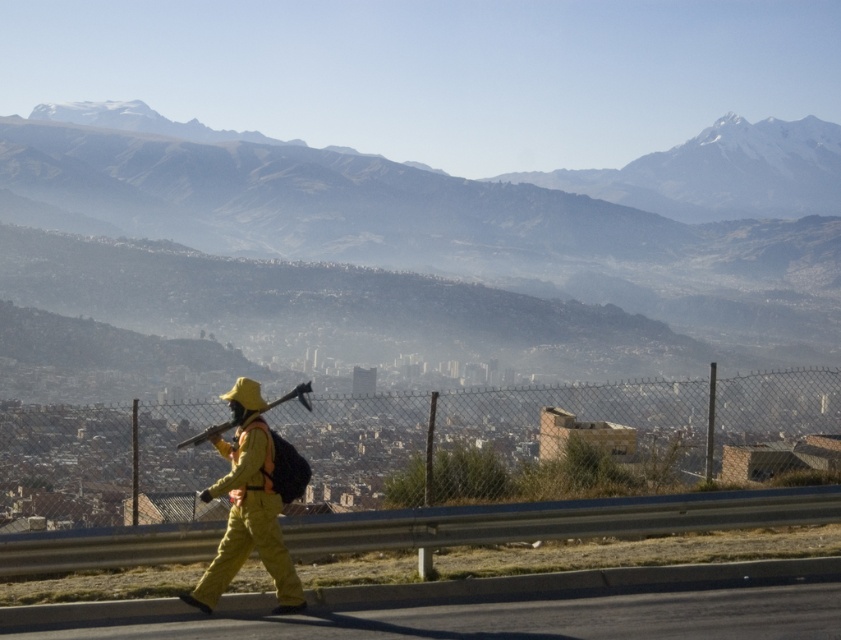
You are a delivery driver who needs to turn left onto the black asphalt highway at lower center. Given that your truck has a turning radius of 12 meters, can you make the turn from your current position at point [532,618]?

The point [532,618] corresponds to the black asphalt highway at lower center. Since the truck requires a turning radius of 12 meters, you would need to ensure there is sufficient space to maneuver. However, the provided information does not include details about the actual dimensions or layout of the highway to confirm if the turning radius is feasible. Without this data, it is impossible to determine if the turn can be made safely.

Looking at this image, you are a drone operator trying to locate a worker in a mountainous area. The worker is wearing a yellow fabric uniform at center. According to the coordinates provided, where exactly is the worker located in the image?

The yellow fabric uniform at center is located at point [252,500] in the image.

You are a delivery driver approaching the black asphalt highway at lower center and the matte black ax at center. Which object will you encounter first?

You will encounter the black asphalt highway at lower center first because it is closer to the viewer than the matte black ax at center.